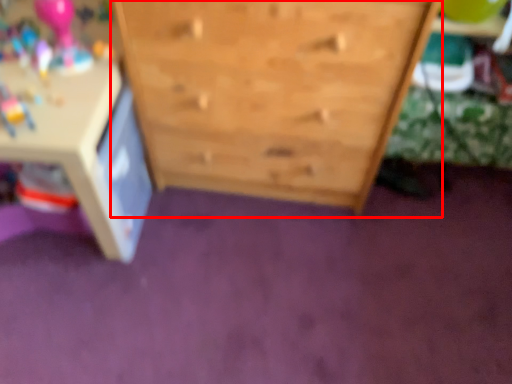
Question: From the image, what is the correct spatial relationship of chest of drawers (annotated by the red box) in relation to table?

Choices:
 (A) left
 (B) right

Answer: (B)